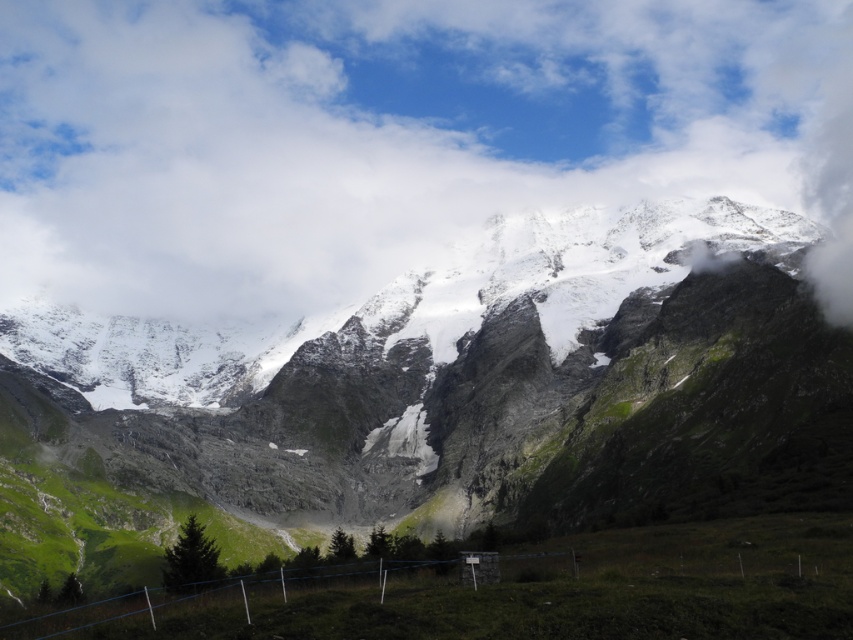
Is white fluffy cloud at upper center closer to camera compared to snowy granite mountain range at upper center?

No.

Can you confirm if white fluffy cloud at upper center is positioned below snowy granite mountain range at upper center?

No, white fluffy cloud at upper center is not below snowy granite mountain range at upper center.

Is point (422, 163) in front of point (207, 461)?

No, (422, 163) is further to viewer.

The width and height of the screenshot is (853, 640). I want to click on white fluffy cloud at upper center, so click(x=387, y=136).